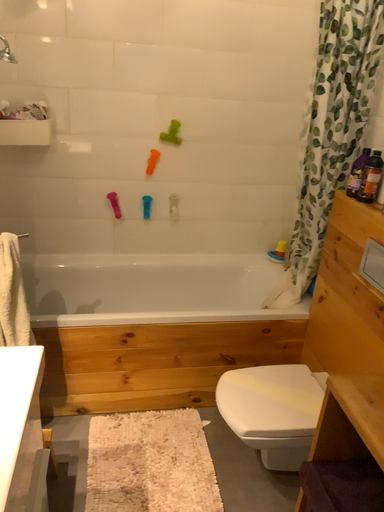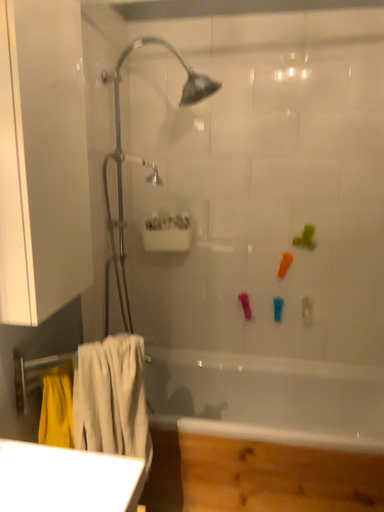
Question: Which way did the camera rotate in the video?

Choices:
 (A) rotated downward
 (B) rotated upward

Answer: (B)